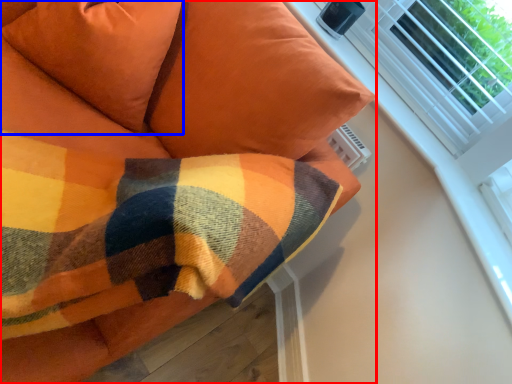
Question: Which object is closer to the camera taking this photo, furniture (highlighted by a red box) or pillow (highlighted by a blue box)?

Choices:
 (A) furniture
 (B) pillow

Answer: (A)